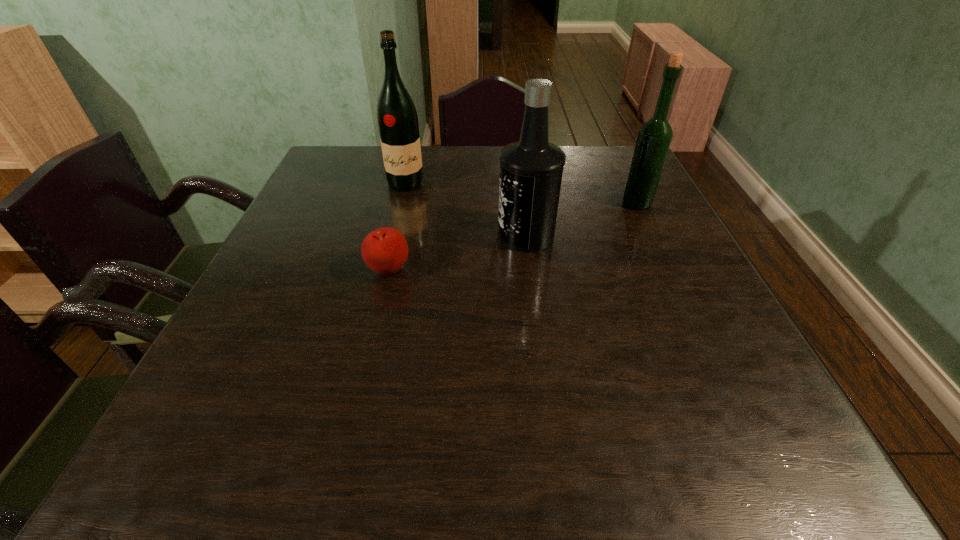
Where is `vacant space at the far left corner of the desktop`? vacant space at the far left corner of the desktop is located at coordinates (359, 160).

In order to click on blank space at the near left corner in this screenshot , I will do `click(232, 426)`.

You are a GUI agent. You are given a task and a screenshot of the screen. Output one action in this format:
    pyautogui.click(x=<x>, y=<y>)
    Task: Click on the vacant point at the near right corner
    
    Given the screenshot: What is the action you would take?
    pyautogui.click(x=807, y=474)

At what (x,y) coordinates should I click in order to perform the action: click on free space between the farthest liquor and the third object from left to right. Please return your answer as a coordinate pair (x, y). Image resolution: width=960 pixels, height=540 pixels. Looking at the image, I should click on (466, 210).

This screenshot has height=540, width=960. I want to click on vacant space in between the rightmost liquor and the third farthest object, so click(582, 219).

The image size is (960, 540). I want to click on free space that is in between the farthest object and the second object from right to left, so click(x=466, y=210).

Locate an element on the screen. The height and width of the screenshot is (540, 960). vacant space that's between the second liquor from left to right and the apple is located at coordinates (457, 253).

Where is `unoccupied area between the rightmost liquor and the nearest liquor`? This screenshot has height=540, width=960. unoccupied area between the rightmost liquor and the nearest liquor is located at coordinates (582, 219).

This screenshot has width=960, height=540. Identify the location of unoccupied area between the shortest object and the farthest object. (397, 227).

What are the coordinates of `the third closest object to the second liquor from right to left` in the screenshot? It's located at (397, 118).